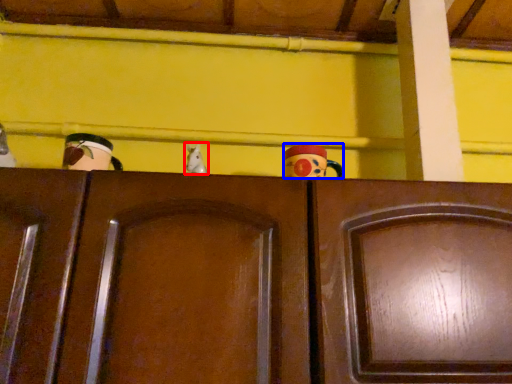
Question: Among these objects, which one is nearest to the camera, toy (highlighted by a red box) or toy (highlighted by a blue box)?

Choices:
 (A) toy
 (B) toy

Answer: (A)